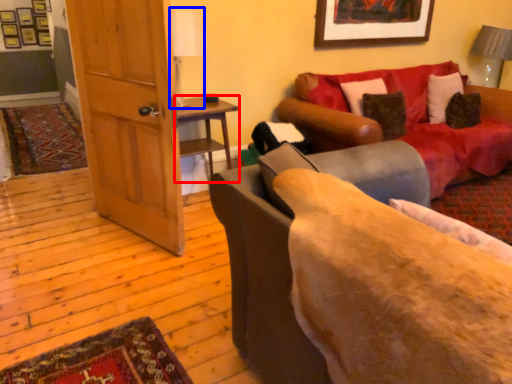
Question: Which object is closer to the camera taking this photo, table (highlighted by a red box) or table lamp (highlighted by a blue box)?

Choices:
 (A) table
 (B) table lamp

Answer: (B)